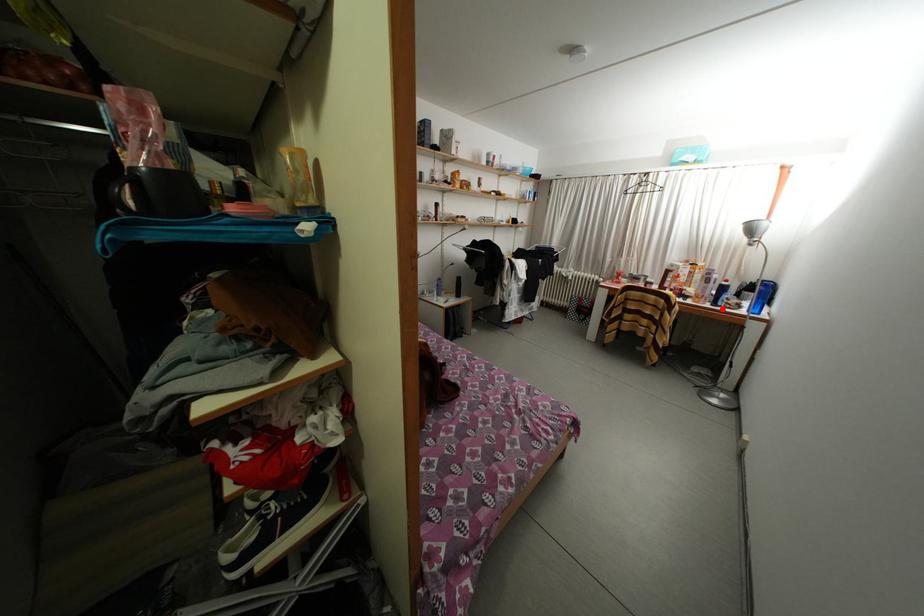
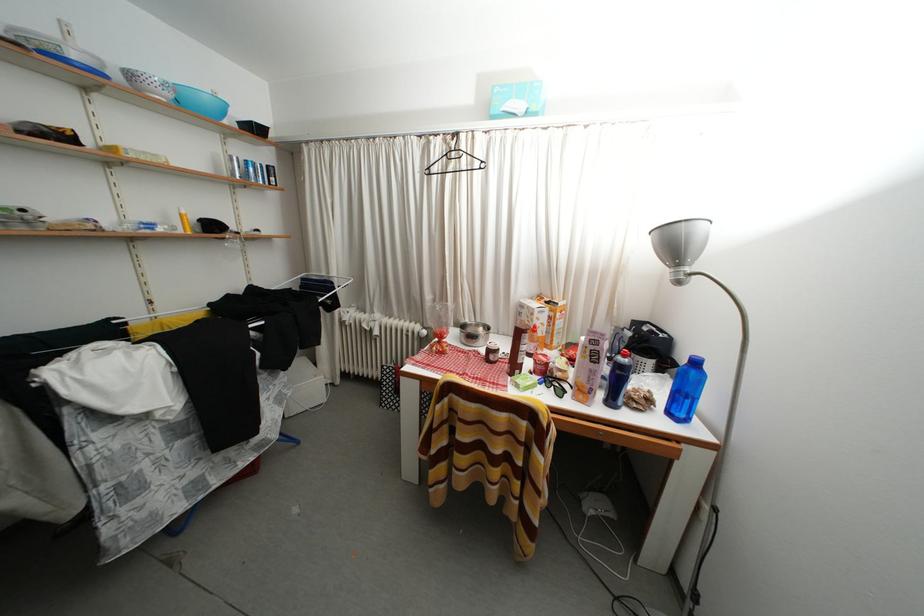
Question: I am providing you with two images of the same scene from different viewpoints. In image1, a red point is highlighted. Considering the same 3D point in image2, which of the following is correct?

Choices:
 (A) It is closer
 (B) It is farther

Answer: (B)